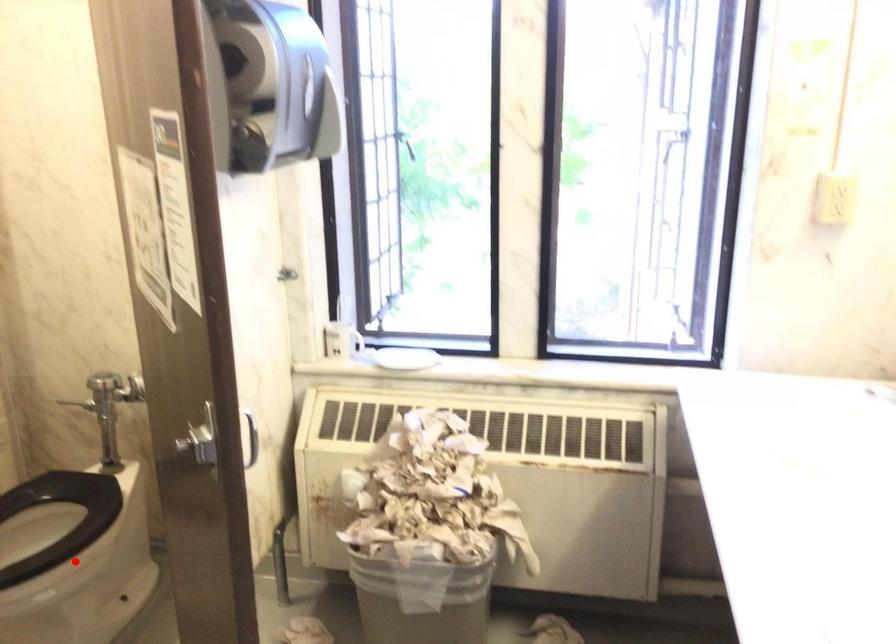
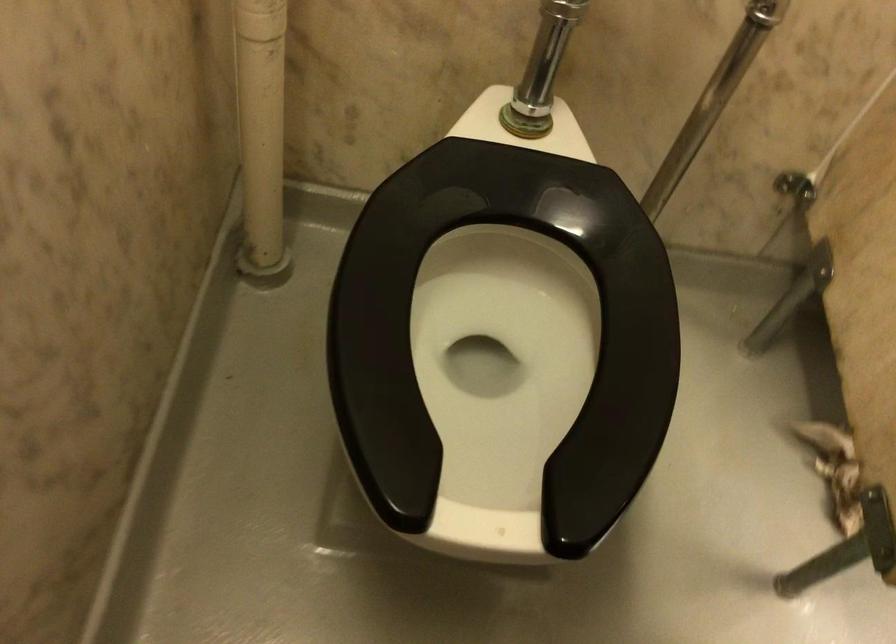
In the second image, find the point that corresponds to the highlighted location in the first image.

(504, 332)